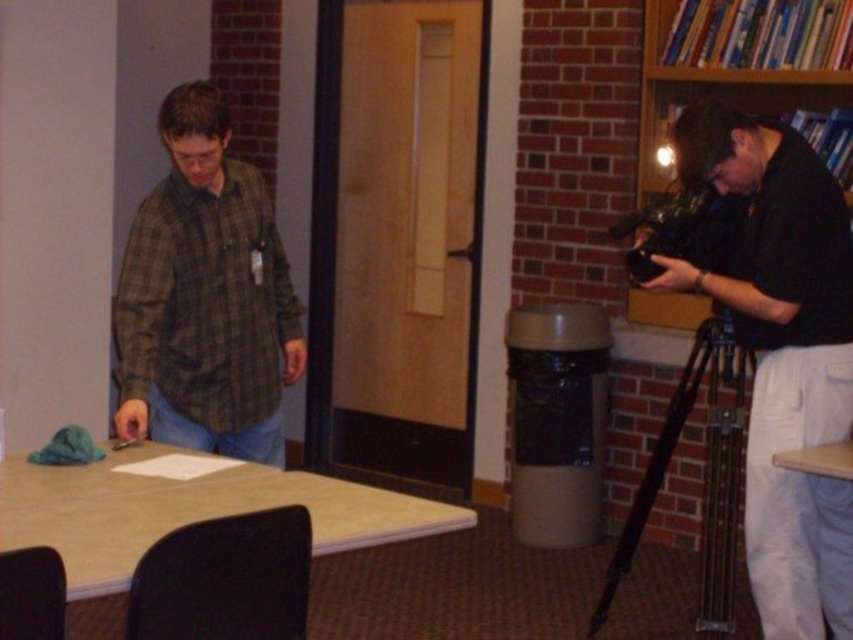
You are standing in the room and want to place a small lamp on the light brown laminate table at lower left. Given that the table has coordinates point at (183, 518), can you confirm the exact location of the table?

The point at (183, 518) indicates the location of the light brown laminate table at lower left, so the table is exactly at that coordinate.

You are standing in the room and want to place a new plant on the light brown laminate table at lower left. What are the coordinates where you should place the plant?

The coordinates for placing the plant on the light brown laminate table at lower left are at point (183, 518).